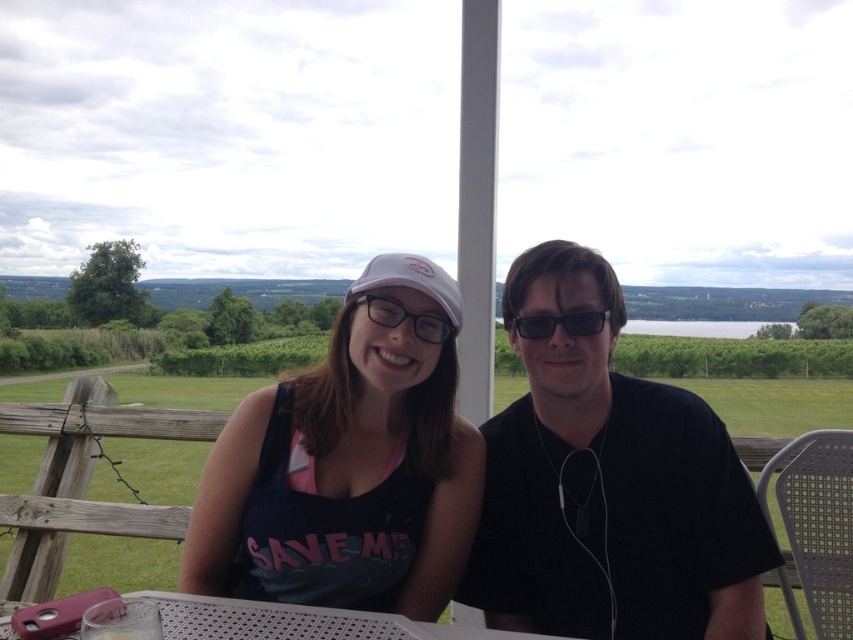
You are a photographer trying to capture a closeup shot of the matte pink cap at center and the white plastic table at lower center. Since you want both objects in focus, you need to know which one is bigger. Which object is larger?

The matte pink cap at center has a larger size compared to the white plastic table at lower center, so the matte pink cap at center is the larger object.

You are planning to place a small potted plant between the two people sitting at the patio. The coordinates for the placement are given as point (347, 468). What object is located at this point?

The point (347, 468) is occupied by the matte pink cap at center.